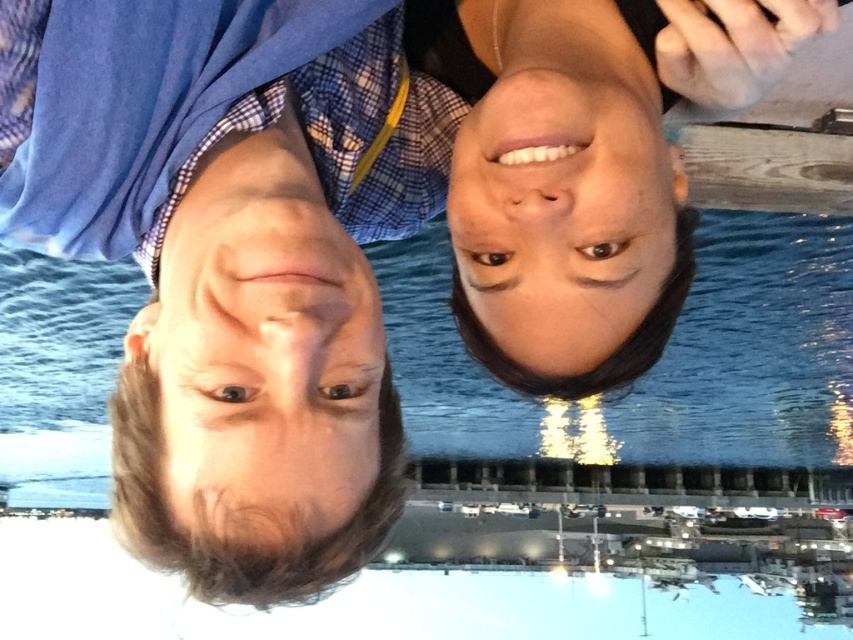
You are a photographer analyzing the image. You notice two points in the image at coordinates point (215, 584) and point (236, 518). Based on the scene, which point is closer to the camera?

Point (236, 518) is closer to the camera than point (215, 584) because the description states that point (215, 584) is further away.

You are a photographer trying to focus on the smooth skin face at center and the blue plaid shirt at left in the rotated image. Which object should you adjust your focus on first to ensure both are in focus?

The blue plaid shirt at left is closer to the viewer than the smooth skin face at center. To ensure both are in focus, you should focus on the blue plaid shirt at left first, as it is closer, and the depth of field will naturally include the farther object.

From the picture: You are a photographer trying to capture a portrait of the two people in the image. The camera you are using has a minimum focusing distance of 2 inches. Can you take a clear photo of both the blue plaid shirt at left and the smooth skin face at center without moving the camera closer?

The distance between the blue plaid shirt at left and the smooth skin face at center is 1.66 inches, which is less than the camera minimum focusing distance of 2 inches. Therefore, the camera cannot focus on both objects simultaneously, so you cannot take a clear photo of both without moving the camera closer.